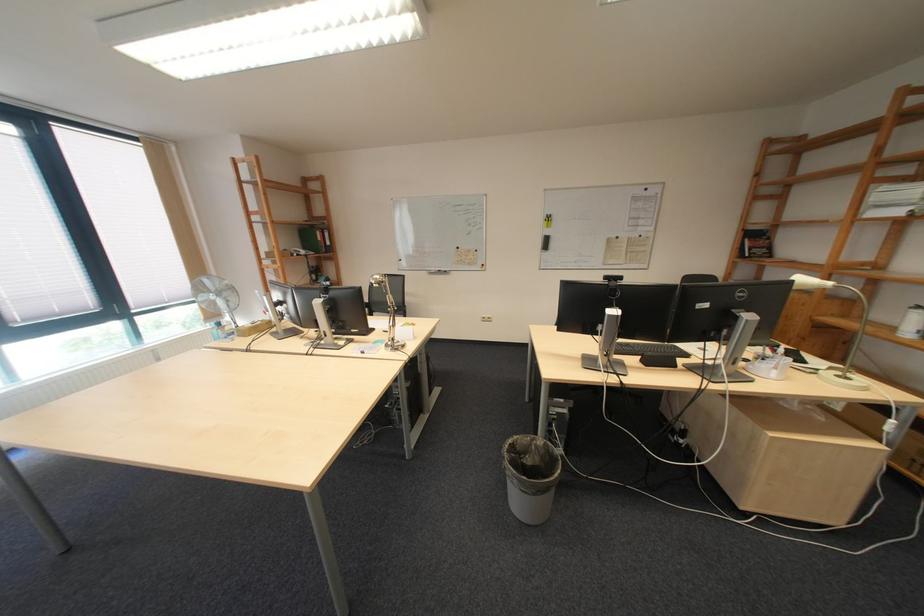
The height and width of the screenshot is (616, 924). I want to click on black computer mouse, so click(x=658, y=360).